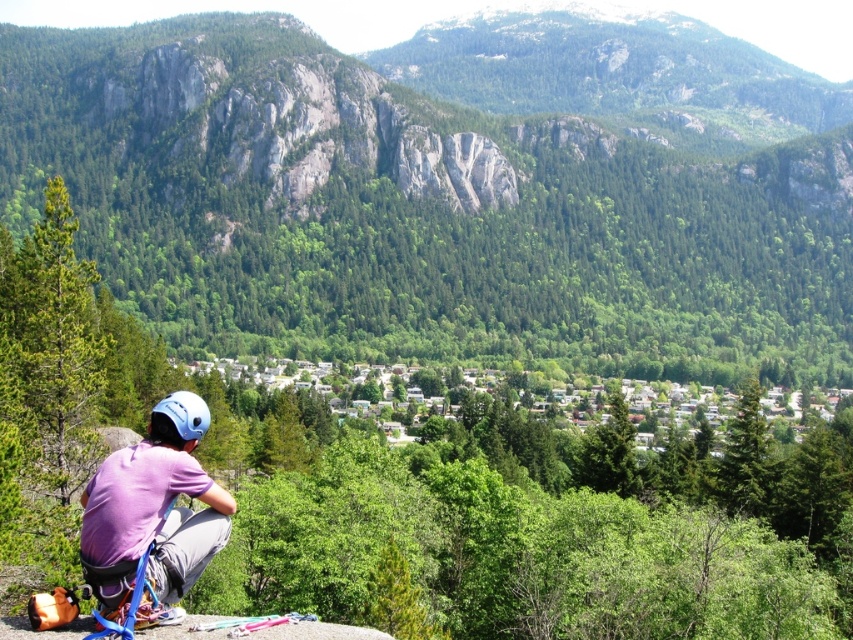
In the scene shown: Between purple fabric helmet at lower left and blue matte helmet at lower left, which one appears on the right side from the viewer's perspective?

Positioned to the right is purple fabric helmet at lower left.

Does purple fabric helmet at lower left have a greater width compared to blue matte helmet at lower left?

In fact, purple fabric helmet at lower left might be narrower than blue matte helmet at lower left.

Where is `purple fabric helmet at lower left`? The image size is (853, 640). purple fabric helmet at lower left is located at coordinates (154, 508).

Locate an element on the screen. The width and height of the screenshot is (853, 640). purple fabric helmet at lower left is located at coordinates (154, 508).

How distant is rocky cliff at center from blue matte helmet at lower left?

They are 697.47 feet apart.

Which of these two, rocky cliff at center or blue matte helmet at lower left, stands shorter?

With less height is blue matte helmet at lower left.

Is point (524, 136) less distant than point (189, 433)?

No, (524, 136) is behind (189, 433).

Locate an element on the screen. The width and height of the screenshot is (853, 640). rocky cliff at center is located at coordinates tap(413, 209).

Which is in front, point (381, 268) or point (125, 461)?

Point (125, 461) is in front.

Can you confirm if rocky cliff at center is wider than purple fabric helmet at lower left?

Yes.

Locate an element on the screen. The width and height of the screenshot is (853, 640). rocky cliff at center is located at coordinates (413, 209).